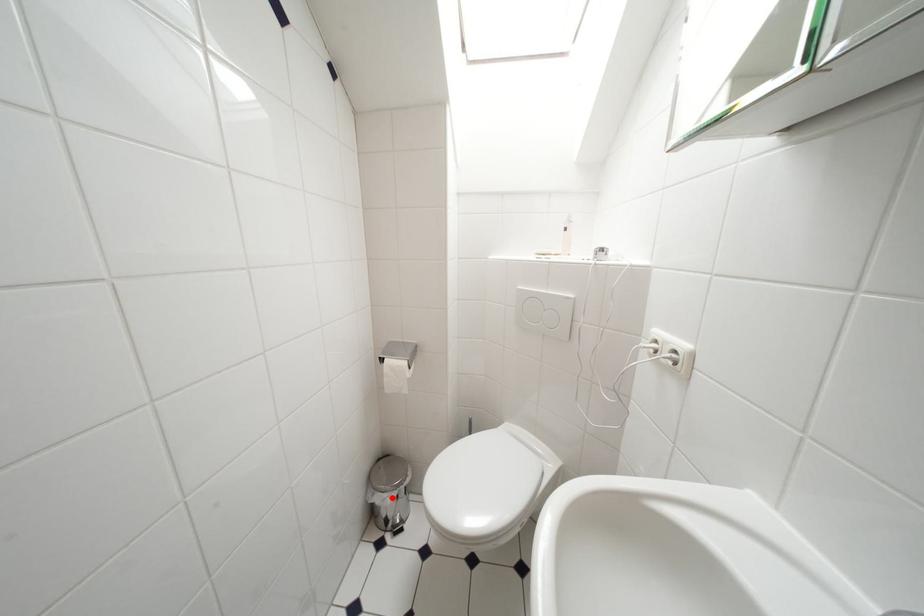
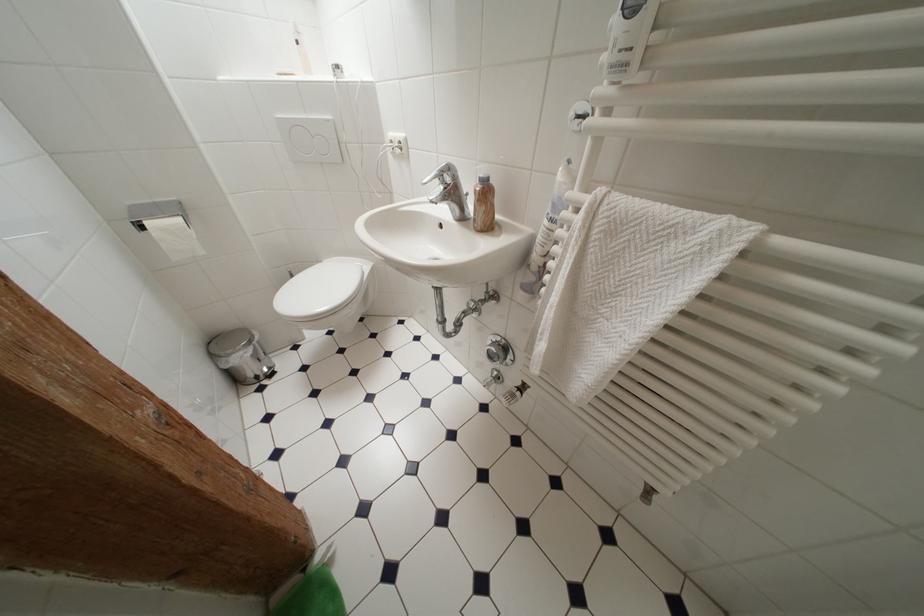
Where in the second image is the point corresponding to the highlighted location from the first image?

(249, 355)